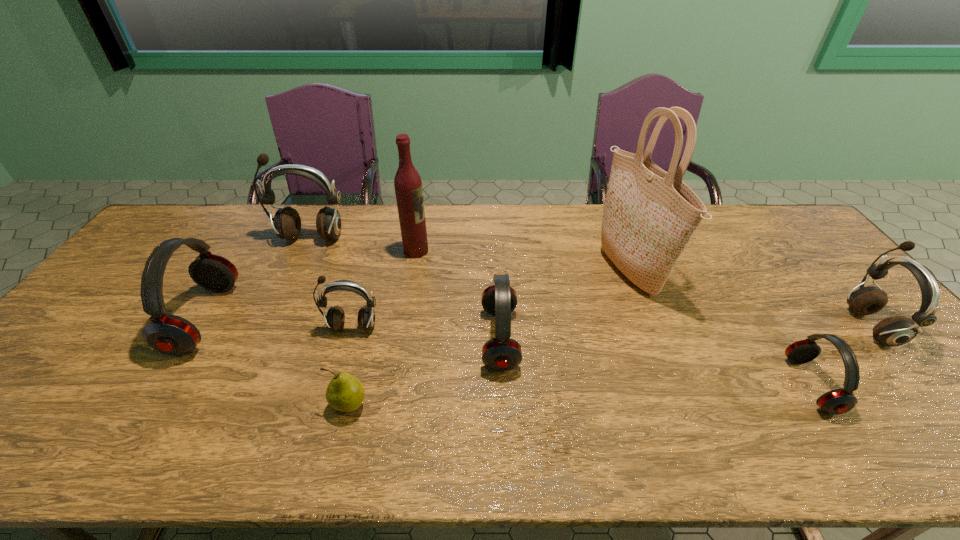
Find the location of a particular element. free space located 0.360m on the left of the shortest object is located at coordinates (171, 406).

Where is `shopping bag positioned at the far edge`? shopping bag positioned at the far edge is located at coordinates (650, 215).

You are a GUI agent. You are given a task and a screenshot of the screen. Output one action in this format:
    pyautogui.click(x=<x>, y=<y>)
    Task: Click on the liquor present at the far edge
    
    Given the screenshot: What is the action you would take?
    pyautogui.click(x=408, y=186)

What are the coordinates of `earphone that is at the far edge` in the screenshot? It's located at (287, 223).

At what (x,y) coordinates should I click in order to perform the action: click on object that is at the right edge. Please return your answer as a coordinate pair (x, y). This screenshot has height=540, width=960. Looking at the image, I should click on (893, 331).

Where is `vacant space at the far edge of the desktop`? The height and width of the screenshot is (540, 960). vacant space at the far edge of the desktop is located at coordinates (239, 213).

In the image, there is a desktop. Where is `blank space at the near edge`? This screenshot has height=540, width=960. blank space at the near edge is located at coordinates (433, 429).

Image resolution: width=960 pixels, height=540 pixels. What are the coordinates of `vacant space at the left edge of the desktop` in the screenshot? It's located at (62, 416).

This screenshot has width=960, height=540. In order to click on vacant space at the right edge in this screenshot , I will do `click(822, 281)`.

Find the location of a particular element. This screenshot has height=540, width=960. free region at the far left corner is located at coordinates (204, 220).